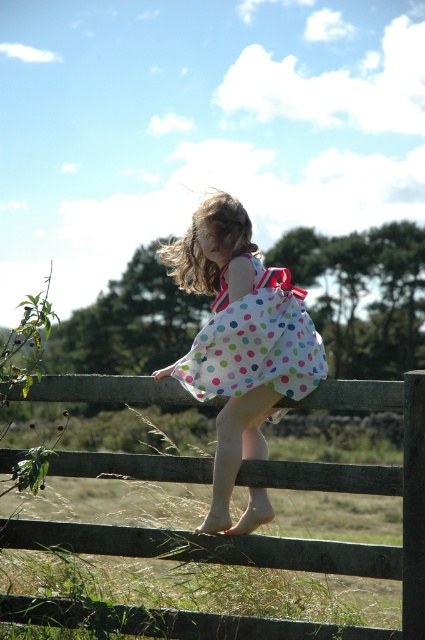
You are a fashion designer observing the image and want to create a new dress design that combines elements from both the white polka dot dress at center and the polka dot fabric dress at center. Which dress should you use as the base pattern if you want the final design to be wider?

You should use the white polka dot dress at center as the base pattern because its width surpasses that of the polka dot fabric dress at center, ensuring the final design will be wider.

You are a painter trying to capture the scene of the young girl standing on the wooden fence. You need to ensure that the wooden fence at center and the white polka dot dress at center are proportionally accurate. Which object should you make wider in your painting to maintain the correct proportions?

The wooden fence at center should be made wider in the painting since its width surpasses that of the white polka dot dress at center according to the description.